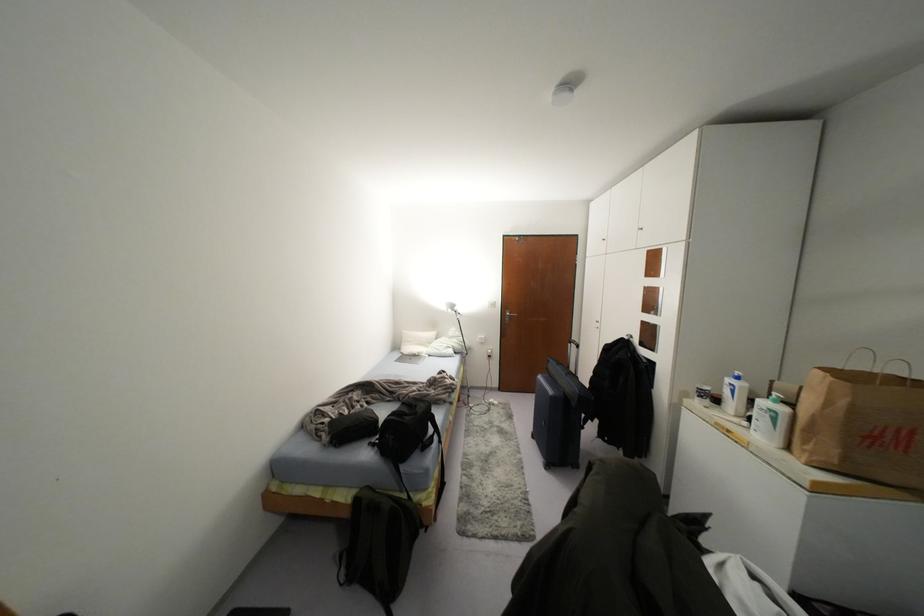
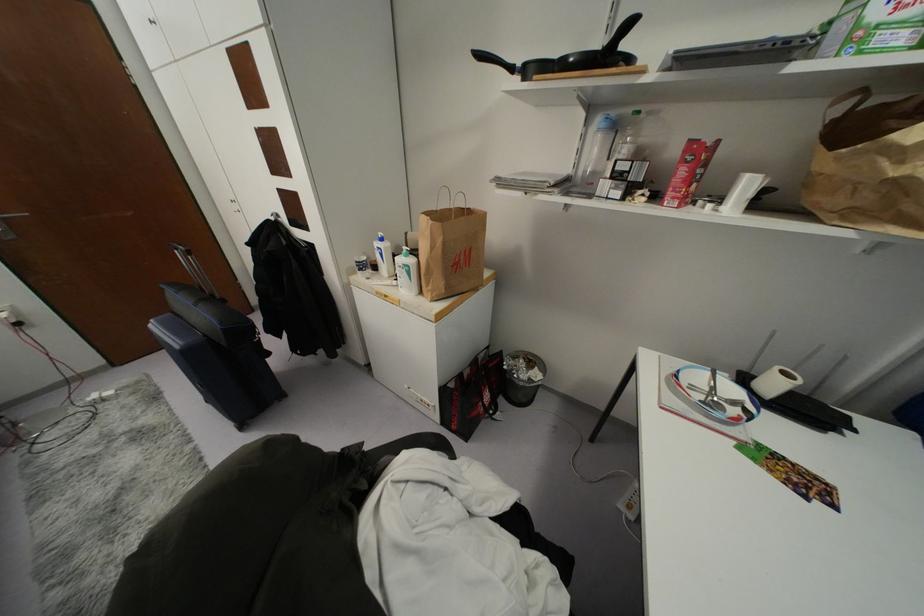
Find the pixel in the second image that matches pixel 782 408 in the first image.

(410, 261)